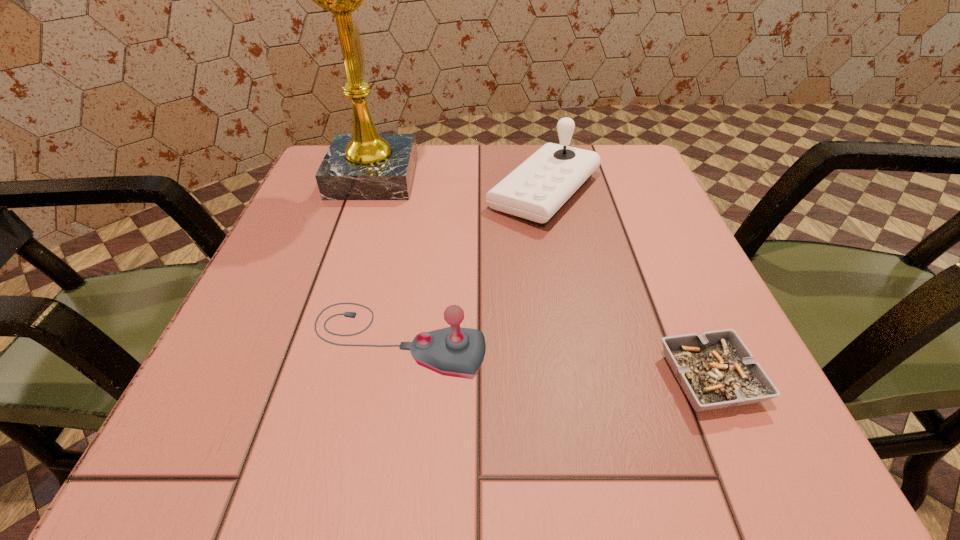
Find the location of a particular element. The image size is (960, 540). award that is at the far edge is located at coordinates (365, 165).

The image size is (960, 540). Find the location of `joystick present at the far edge`. joystick present at the far edge is located at coordinates (536, 190).

Identify the location of object located at the near edge. Image resolution: width=960 pixels, height=540 pixels. (716, 370).

Locate an element on the screen. The image size is (960, 540). award that is at the left edge is located at coordinates (365, 165).

Locate an element on the screen. The height and width of the screenshot is (540, 960). joystick that is positioned at the left edge is located at coordinates (454, 351).

At what (x,y) coordinates should I click in order to perform the action: click on joystick that is at the right edge. Please return your answer as a coordinate pair (x, y). This screenshot has height=540, width=960. Looking at the image, I should click on (536, 190).

I want to click on ashtray at the right edge, so click(716, 370).

This screenshot has width=960, height=540. Identify the location of object present at the far left corner. (365, 165).

Where is `object situated at the far right corner`? object situated at the far right corner is located at coordinates (536, 190).

Where is `object present at the near right corner`? Image resolution: width=960 pixels, height=540 pixels. object present at the near right corner is located at coordinates (716, 370).